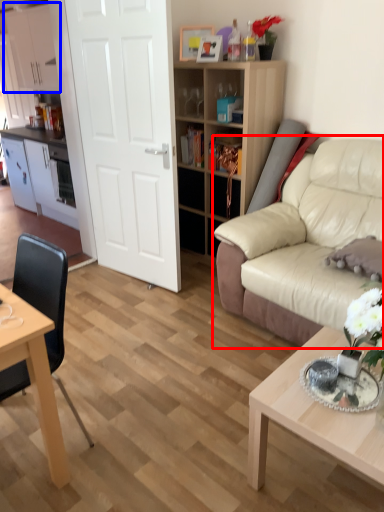
Question: Which object appears closest to the camera in this image, studio couch (highlighted by a red box) or cabinetry (highlighted by a blue box)?

Choices:
 (A) studio couch
 (B) cabinetry

Answer: (A)